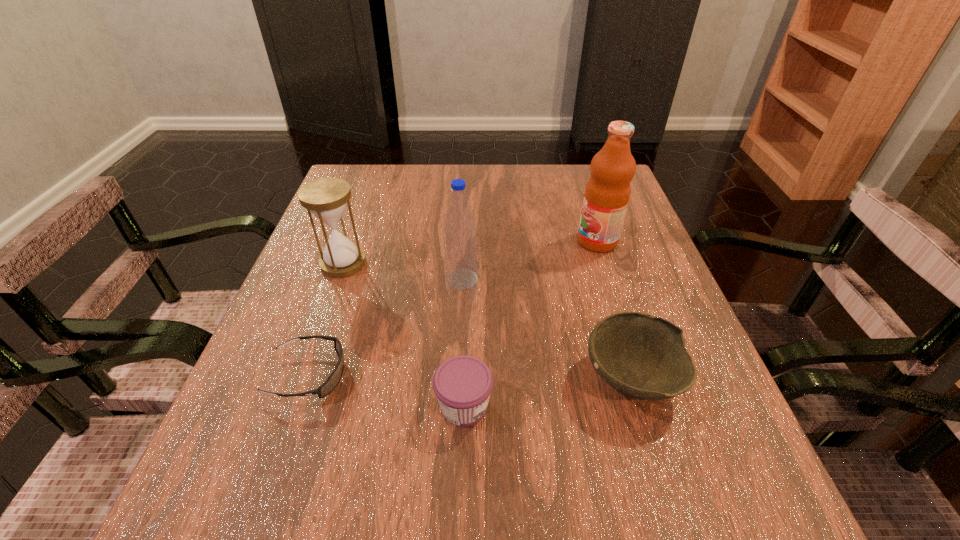
Identify the location of free location located on the front of the hourglass. This screenshot has height=540, width=960. (287, 422).

Find the location of a particular element. vacant position located 0.330m on the left of the bowl is located at coordinates (385, 379).

What are the coordinates of `vacant space located 0.110m on the front label of the jam` in the screenshot? It's located at (563, 406).

Find the location of a particular element. The height and width of the screenshot is (540, 960). free spot located on the lenses of the goggles is located at coordinates (459, 375).

Image resolution: width=960 pixels, height=540 pixels. Identify the location of hourglass present at the left edge. (326, 198).

Find the location of a particular element. goggles that is at the left edge is located at coordinates (329, 385).

You are a GUI agent. You are given a task and a screenshot of the screen. Output one action in this format:
    pyautogui.click(x=<x>, y=<y>)
    Task: Click on the fruit juice situated at the right edge
    
    Given the screenshot: What is the action you would take?
    pyautogui.click(x=607, y=193)

I want to click on bowl located at the right edge, so click(643, 357).

Identify the location of free space at the far edge of the desktop. Image resolution: width=960 pixels, height=540 pixels. (528, 169).

Image resolution: width=960 pixels, height=540 pixels. What are the coordinates of `vacant position at the near edge of the desktop` in the screenshot? It's located at (467, 507).